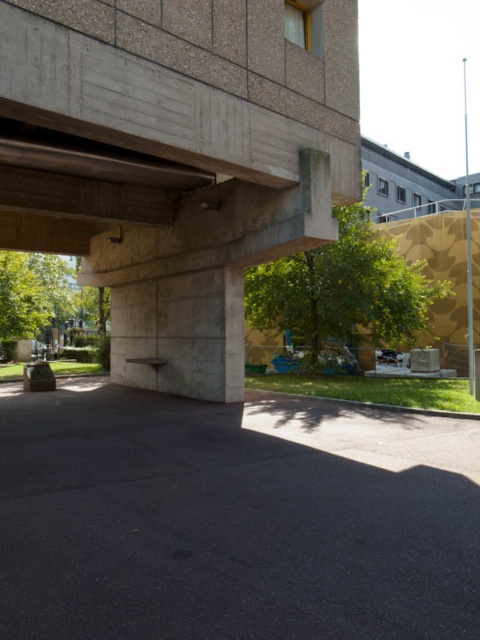
Question: Among these points, which one is nearest to the camera?

Choices:
 (A) (33, 548)
 (B) (92, 282)

Answer: (A)

Question: Is gray concrete at center to the left of concrete at upper left from the viewer's perspective?

Choices:
 (A) no
 (B) yes

Answer: (A)

Question: Among these points, which one is farthest from the camera?

Choices:
 (A) (399, 522)
 (B) (280, 244)

Answer: (B)

Question: Among these points, which one is nearest to the camera?

Choices:
 (A) (130, 356)
 (B) (345, 582)

Answer: (B)

Question: Does gray concrete at center appear on the right side of concrete at upper left?

Choices:
 (A) no
 (B) yes

Answer: (B)

Question: Can you confirm if gray concrete at center is positioned below concrete at upper left?

Choices:
 (A) yes
 (B) no

Answer: (A)